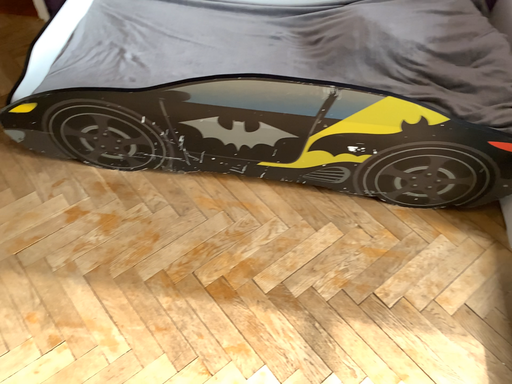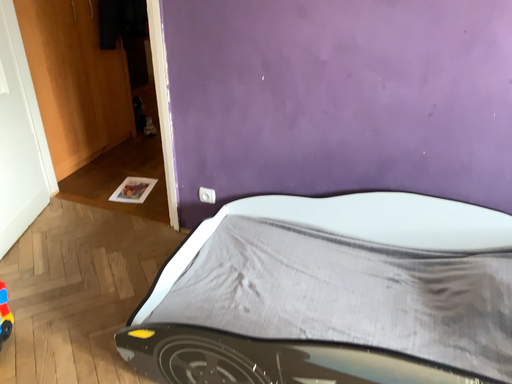
Question: How did the camera likely rotate when shooting the video?

Choices:
 (A) rotated left
 (B) rotated right

Answer: (A)